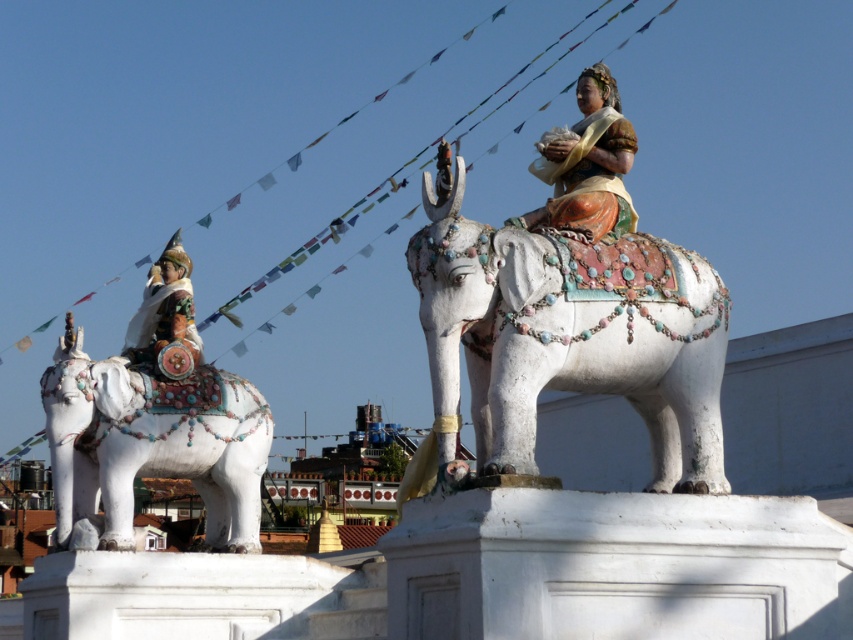
Question: Does white glossy elephant at left have a greater width compared to matte white statue at left?

Choices:
 (A) no
 (B) yes

Answer: (A)

Question: Which of the following is the farthest from the observer?

Choices:
 (A) (601, 211)
 (B) (479, 444)
 (C) (149, 346)

Answer: (C)

Question: Among these objects, which one is nearest to the camera?

Choices:
 (A) white glossy elephant at left
 (B) white glossy elephant at center

Answer: (B)

Question: Does white glossy elephant at left have a smaller size compared to polychrome painted statue at upper right?

Choices:
 (A) no
 (B) yes

Answer: (A)

Question: Among these objects, which one is nearest to the camera?

Choices:
 (A) white glossy elephant at center
 (B) white glossy elephant at left
 (C) matte white statue at left
 (D) polychrome painted statue at upper right

Answer: (A)

Question: Is white glossy elephant at center wider than polychrome painted statue at upper right?

Choices:
 (A) yes
 (B) no

Answer: (A)